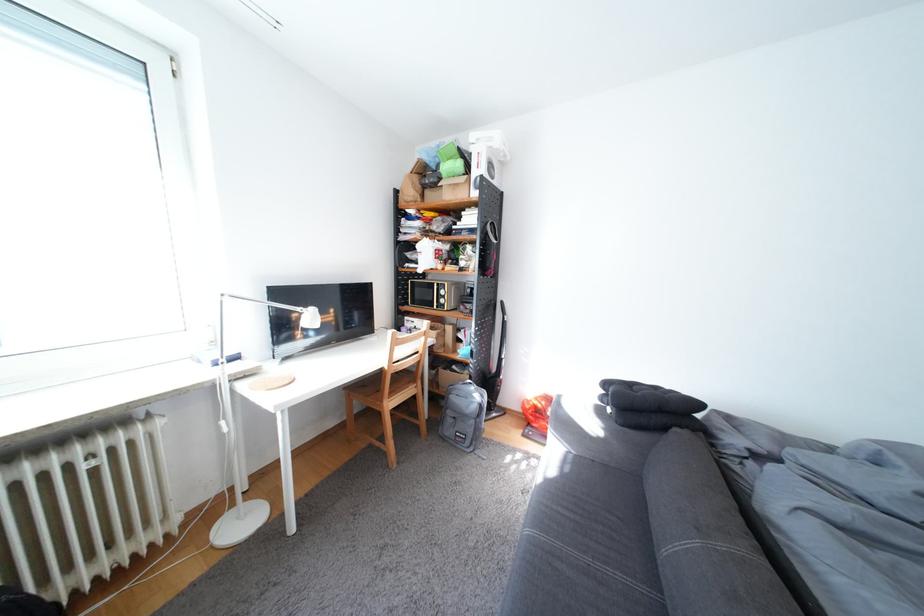
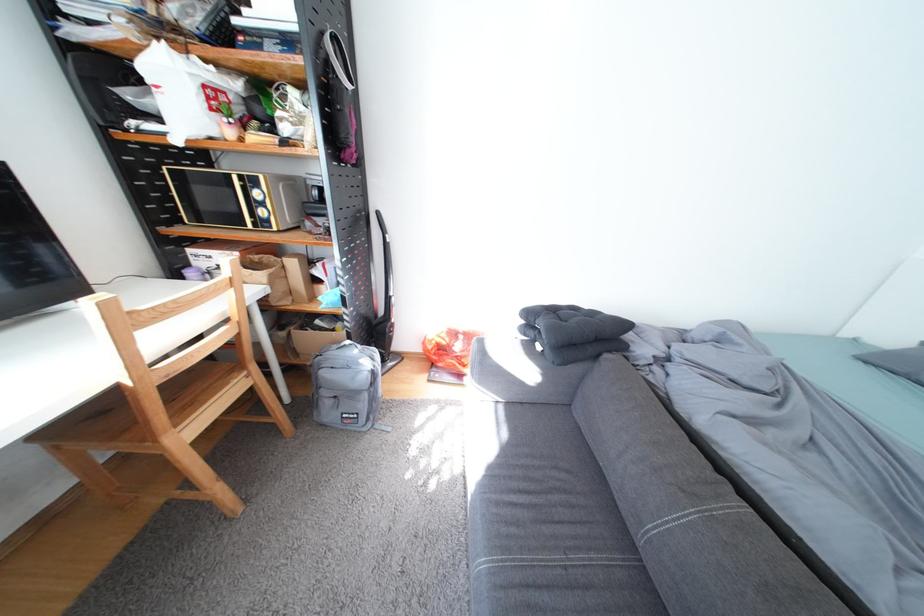
Find the pixel in the second image that matches pixel 450 339 in the first image.

(285, 284)